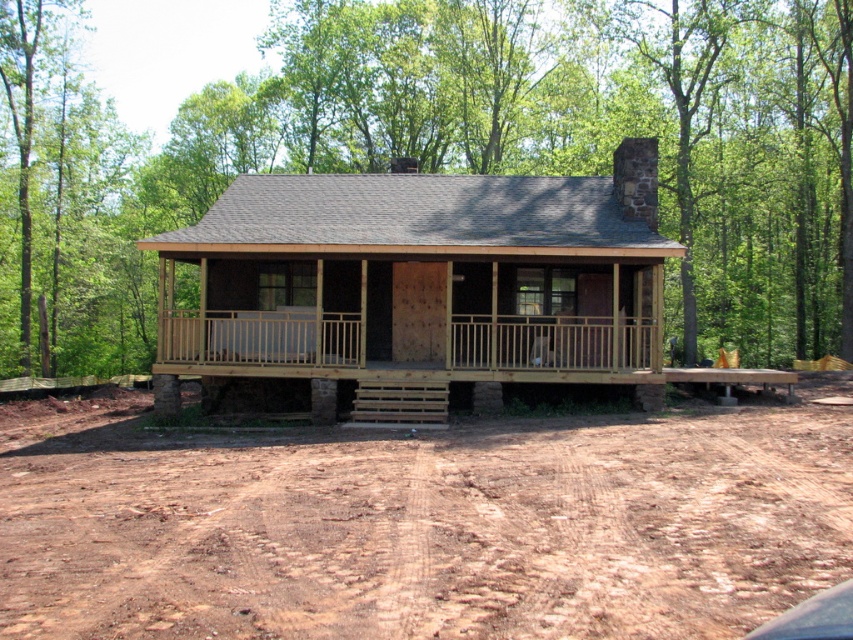
Locate an element on the screen. This screenshot has width=853, height=640. brown dirt field at lower center is located at coordinates (421, 524).

Which is more to the right, brown dirt field at lower center or natural wood porch at center?

Positioned to the right is brown dirt field at lower center.

What do you see at coordinates (421, 524) in the screenshot?
I see `brown dirt field at lower center` at bounding box center [421, 524].

The height and width of the screenshot is (640, 853). I want to click on brown dirt field at lower center, so click(x=421, y=524).

Does green leafy tree at center have a lesser height compared to natural wood porch at center?

No.

Is green leafy tree at center to the right of natural wood porch at center from the viewer's perspective?

No, green leafy tree at center is not to the right of natural wood porch at center.

Between point (700, 188) and point (231, 344), which one is positioned in front?

Point (231, 344) is in front.

Where is `green leafy tree at center`? This screenshot has height=640, width=853. green leafy tree at center is located at coordinates (450, 152).

Who is positioned more to the right, green leafy tree at center or wooden cabin at center?

wooden cabin at center is more to the right.

Is point (68, 129) closer to viewer compared to point (326, 285)?

No, (68, 129) is further to viewer.

Find the location of `green leafy tree at center`. green leafy tree at center is located at coordinates (450, 152).